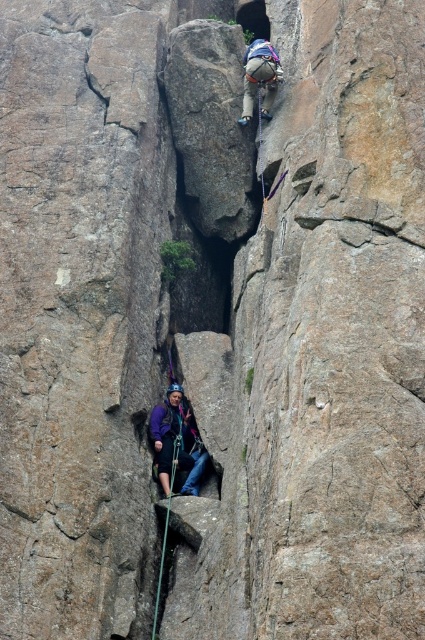
Does matte gray helmet at upper center have a greater height compared to green nylon rope at center?

No, matte gray helmet at upper center is not taller than green nylon rope at center.

Is matte gray helmet at upper center below green nylon rope at center?

No.

Locate an element on the screen. matte gray helmet at upper center is located at coordinates (260, 77).

Is purple fabric at center smaller than green nylon rope at center?

Indeed, purple fabric at center has a smaller size compared to green nylon rope at center.

Does purple fabric at center lie in front of green nylon rope at center?

No, it is not.

Find the location of a particular element. purple fabric at center is located at coordinates (178, 442).

Does purple fabric at center have a greater width compared to matte gray helmet at upper center?

Incorrect, purple fabric at center's width does not surpass matte gray helmet at upper center's.

Which of these two, purple fabric at center or matte gray helmet at upper center, stands taller?

matte gray helmet at upper center

Locate an element on the screen. The height and width of the screenshot is (640, 425). purple fabric at center is located at coordinates (178, 442).

Find the location of a particular element. This screenshot has height=640, width=425. purple fabric at center is located at coordinates (178, 442).